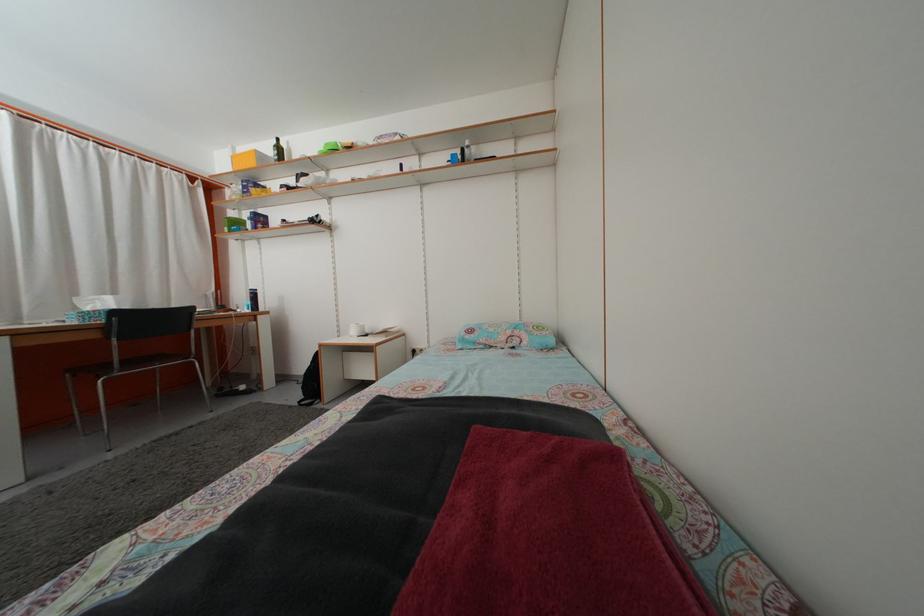
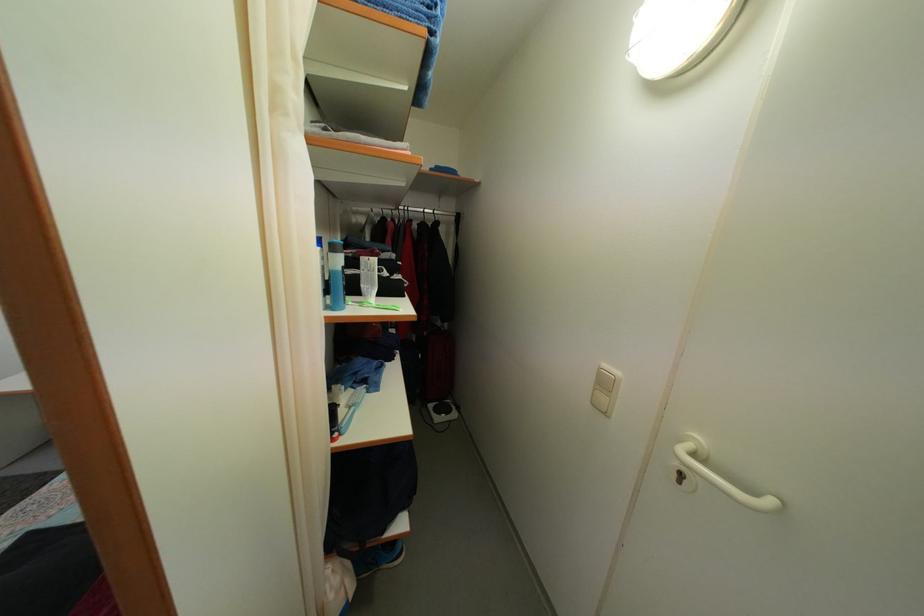
Question: How did the camera likely rotate?

Choices:
 (A) Left
 (B) Right
 (C) Up
 (D) Down

Answer: (B)